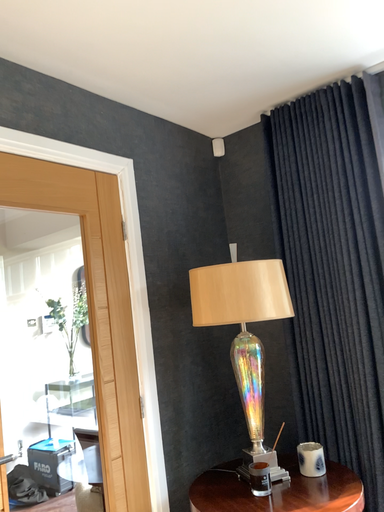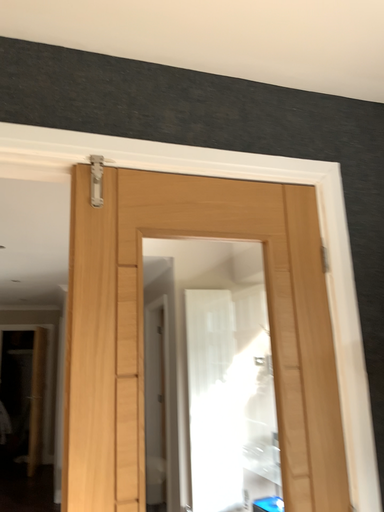
Question: How did the camera likely rotate when shooting the video?

Choices:
 (A) rotated right
 (B) rotated left

Answer: (B)